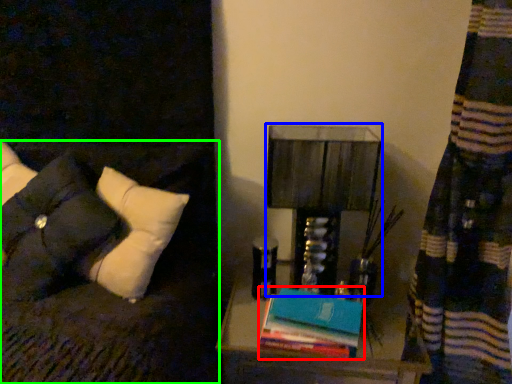
Question: Which is nearer to the book (highlighted by a red box)? table lamp (highlighted by a blue box) or furniture (highlighted by a green box).

Choices:
 (A) table lamp
 (B) furniture

Answer: (A)